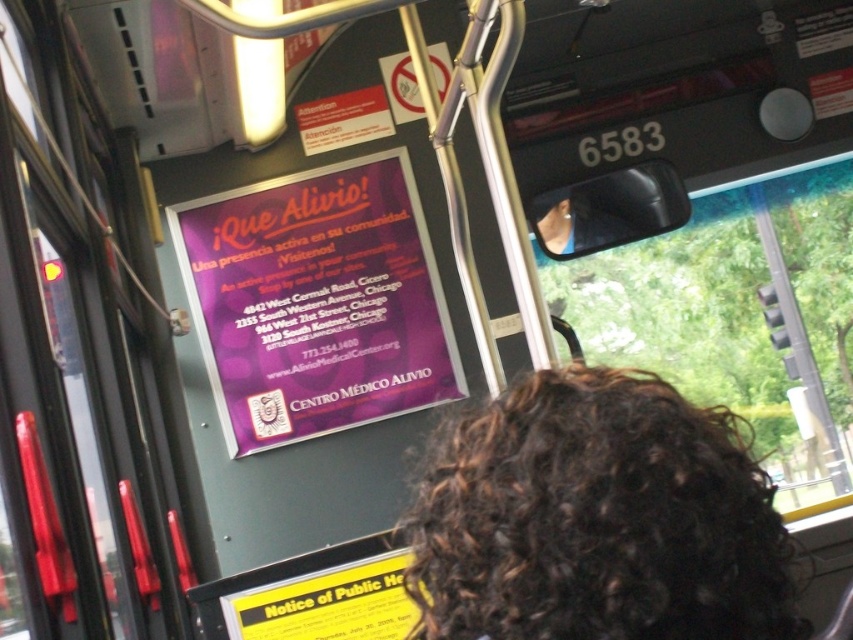
Question: Which point appears closest to the camera in this image?

Choices:
 (A) (402, 605)
 (B) (502, 592)
 (C) (256, 339)

Answer: (B)

Question: Among these points, which one is farthest from the camera?

Choices:
 (A) pos(329,172)
 (B) pos(735,634)

Answer: (A)

Question: Does transparent glass window at upper center appear over yellow paper notice of public health at lower center?

Choices:
 (A) yes
 (B) no

Answer: (A)

Question: Which is farther from the transparent glass window at upper center?

Choices:
 (A) purple glossy poster at upper center
 (B) dark curly hair at upper center

Answer: (B)

Question: Can you confirm if purple glossy poster at upper center is bigger than yellow paper notice of public health at lower center?

Choices:
 (A) yes
 (B) no

Answer: (A)

Question: Considering the relative positions of dark curly hair at upper center and transparent glass window at upper center in the image provided, where is dark curly hair at upper center located with respect to transparent glass window at upper center?

Choices:
 (A) above
 (B) below

Answer: (B)